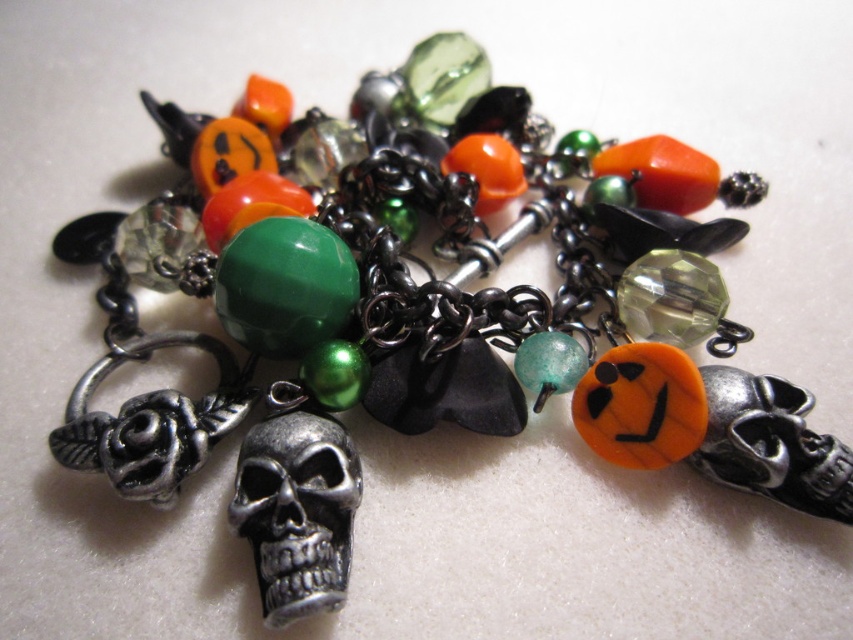
Does point (622, 301) come behind point (548, 384)?

Yes, point (622, 301) is behind point (548, 384).

Who is more forward, (692, 337) or (534, 360)?

Positioned in front is point (534, 360).

Where is `transparent faceted bead at center`? The image size is (853, 640). transparent faceted bead at center is located at coordinates (671, 298).

What are the coordinates of `transparent faceted bead at center` in the screenshot? It's located at (671, 298).

Is metallic skull at center shorter than translucent green glass bead at center?

Incorrect, metallic skull at center's height does not fall short of translucent green glass bead at center's.

Between point (343, 442) and point (566, 348), which one is positioned behind?

The point (566, 348) is more distant.

Locate an element on the screen. This screenshot has width=853, height=640. metallic skull at center is located at coordinates (297, 512).

Which is behind, point (321, 458) or point (708, 275)?

Point (708, 275)

Is metallic skull at center bigger than transparent faceted bead at center?

Yes.

Does point (282, 481) come behind point (645, 332)?

No, it is in front of (645, 332).

This screenshot has width=853, height=640. What are the coordinates of `metallic skull at center` in the screenshot? It's located at (297, 512).